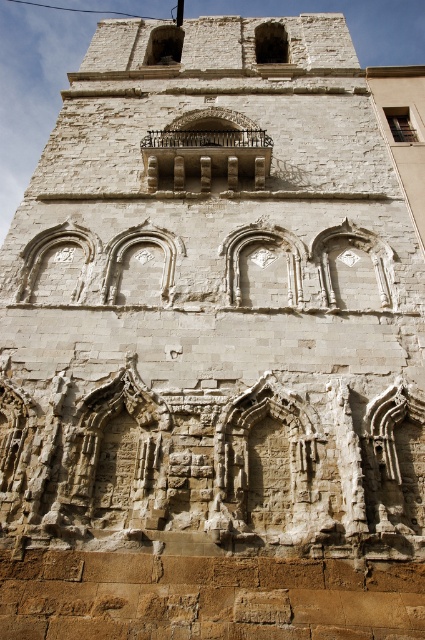
You are standing in front of the ancient stone structure and notice two points marked on the facade. The first point is at coordinate point(291,294) and the second is at point(172,58). Which of these points is closer to your current position?

Point(291,294) is closer to the camera than point(172,58), so the first point is closer to your current position.